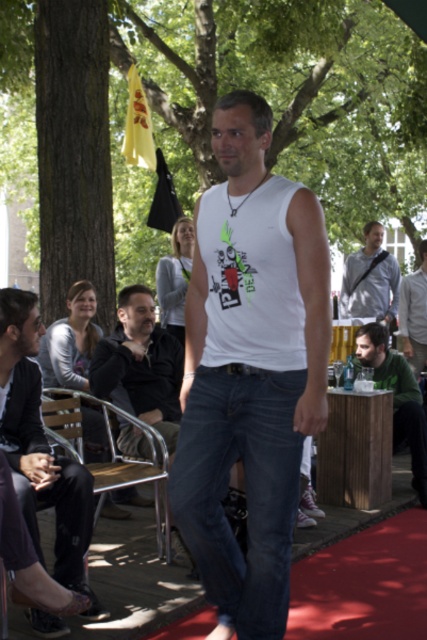
You are standing at the position of the man on the red carpeted area. You want to walk to the nearest point between point [66,500] and point [169,557]. Which point should you walk to?

Point [66,500] is in front of point [169,557], so you should walk to point [66,500] because it is closer to your current position.

You are a photographer standing in front of the scene. You want to take a photo focusing on the white matte tank top at center and dark blue denim jeans at center. Which object will appear larger in the photo?

The white matte tank top at center will appear larger in the photo because it is closer to the viewer than the dark blue denim jeans at center.

Based on the coordinates provided, where is the white matte tank top at center located in the image?

The white matte tank top at center is located at the 2D coordinates point (x=249, y=369) in the image.